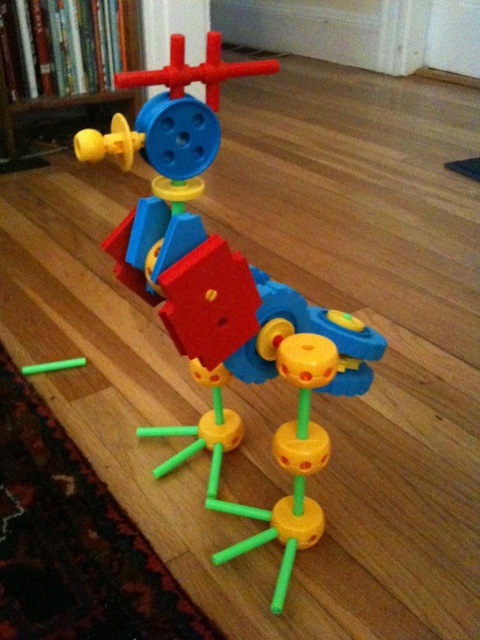
You are a child looking at the colorful toy structure on the wooden floor. You see the matte plastic toy at center and the matte yellow plastic toy at upper left. Which toy is positioned lower in the image?

The matte plastic toy at center is positioned below the matte yellow plastic toy at upper left, so it is lower in the image.

You are organizing a toy storage bin and need to decide which toy to place first. Given the matte plastic toy at center and the matte yellow plastic toy at upper left, which one should you put into the bin first to maximize space efficiency?

The matte plastic toy at center occupies less space than the matte yellow plastic toy at upper left, so you should place the matte yellow plastic toy at upper left first to make room for the smaller one later.